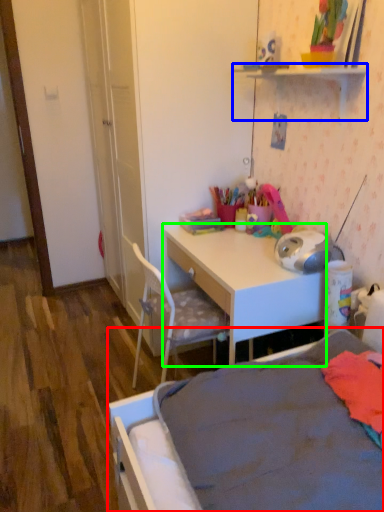
Question: Estimate the real-world distances between objects in this image. Which object is farther from bed (highlighted by a red box), shelf (highlighted by a blue box) or desk (highlighted by a green box)?

Choices:
 (A) shelf
 (B) desk

Answer: (A)